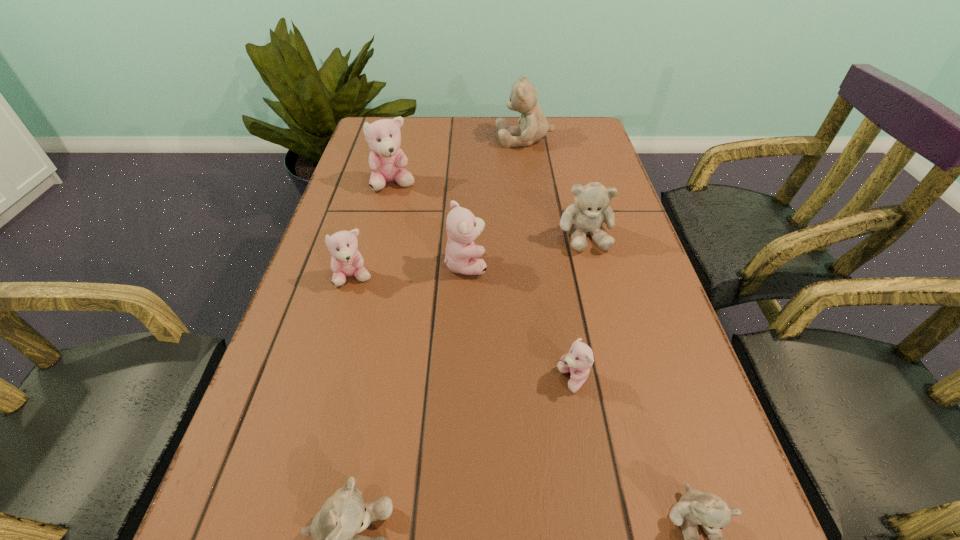
You are a GUI agent. You are given a task and a screenshot of the screen. Output one action in this format:
    pyautogui.click(x=<x>, y=<y>)
    Task: Click on the fifth closest object to the third smallest gray teddy bear
    Image resolution: width=960 pixels, height=540 pixels.
    Given the screenshot: What is the action you would take?
    pos(346,261)

Identify the location of object that is the closest to the farthest teddy bear. The height and width of the screenshot is (540, 960). (387, 161).

Locate which teddy bear is the closest to the third nearest teddy bear. Please provide its 2D coordinates. Your answer should be formatted as a tuple, i.e. [(x, y)], where the tuple contains the x and y coordinates of a point satisfying the conditions above.

[(712, 513)]

Locate which teddy bear ranks second in proximity to the seventh nearest teddy bear. Please provide its 2D coordinates. Your answer should be formatted as a tuple, i.e. [(x, y)], where the tuple contains the x and y coordinates of a point satisfying the conditions above.

[(533, 127)]

Find the location of a particular element. The height and width of the screenshot is (540, 960). pink teddy bear that is the closest to the third smallest pink teddy bear is located at coordinates (346, 261).

Locate an element on the screen. This screenshot has width=960, height=540. pink teddy bear that stands as the third closest to the third nearest teddy bear is located at coordinates (387, 161).

The height and width of the screenshot is (540, 960). What are the coordinates of `gray teddy bear that is the third closest one to the smallest gray teddy bear` in the screenshot? It's located at (533, 127).

Find the location of `the closest gray teddy bear to the third smallest pink teddy bear`. the closest gray teddy bear to the third smallest pink teddy bear is located at coordinates (591, 208).

Locate an element on the screen. free space that satisfies the following two spatial constraints: 1. on the face of the biggest gray teddy bear; 2. at the face of the third biggest pink teddy bear is located at coordinates (545, 278).

This screenshot has height=540, width=960. In order to click on free space that satisfies the following two spatial constraints: 1. on the face of the third nearest gray teddy bear; 2. at the face of the fourth object from left to right in this screenshot , I will do `click(593, 264)`.